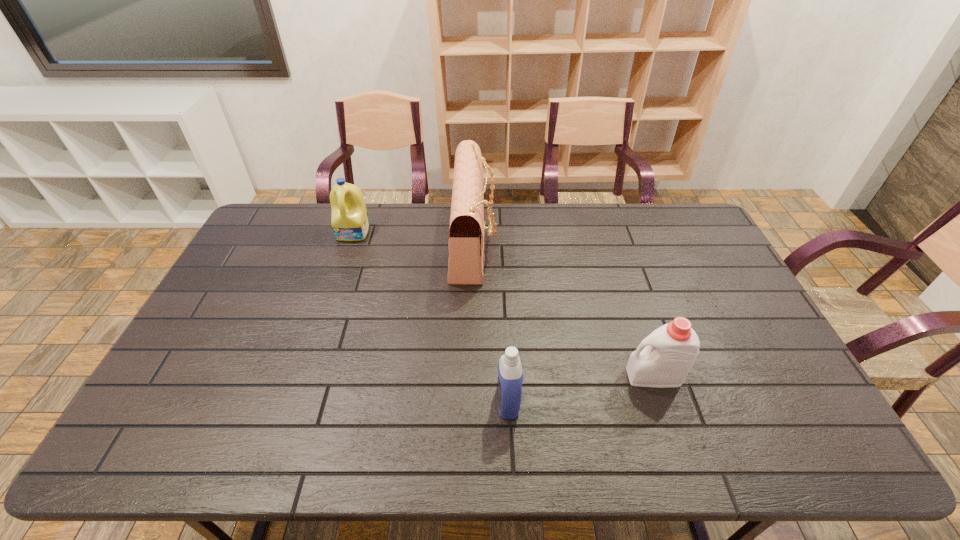
Where is `the tallest object`? the tallest object is located at coordinates (467, 227).

Find the location of a particular element. This screenshot has width=960, height=540. the farthest detergent is located at coordinates (349, 219).

Identify the location of the leftmost detergent. (349, 219).

Locate an element on the screen. the rightmost detergent is located at coordinates (663, 359).

Identify the location of the second detergent from right to left. This screenshot has height=540, width=960. (510, 373).

Find the location of `vacant space situated on the front-facing side of the handbag`. vacant space situated on the front-facing side of the handbag is located at coordinates coord(596,241).

The width and height of the screenshot is (960, 540). I want to click on vacant area situated on the label of the leftmost object, so click(344, 262).

The image size is (960, 540). I want to click on free region located 0.240m on the handle side of the rightmost detergent, so click(537, 376).

Where is `blank space located on the handle side of the rightmost detergent`? blank space located on the handle side of the rightmost detergent is located at coordinates (506, 376).

Locate an element on the screen. The width and height of the screenshot is (960, 540). vacant region located on the handle side of the rightmost detergent is located at coordinates click(x=563, y=376).